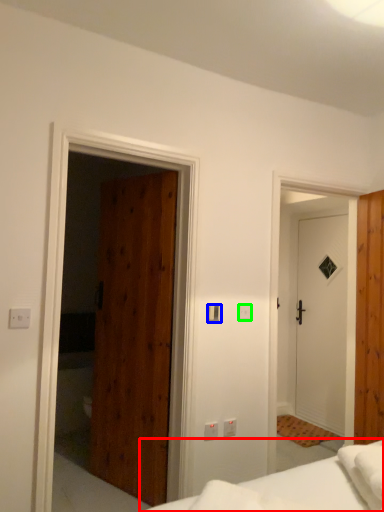
Question: Based on their relative distances, which object is farther from bed (highlighted by a red box)? Choose from light switch (highlighted by a blue box) and light switch (highlighted by a green box).

Choices:
 (A) light switch
 (B) light switch

Answer: (B)